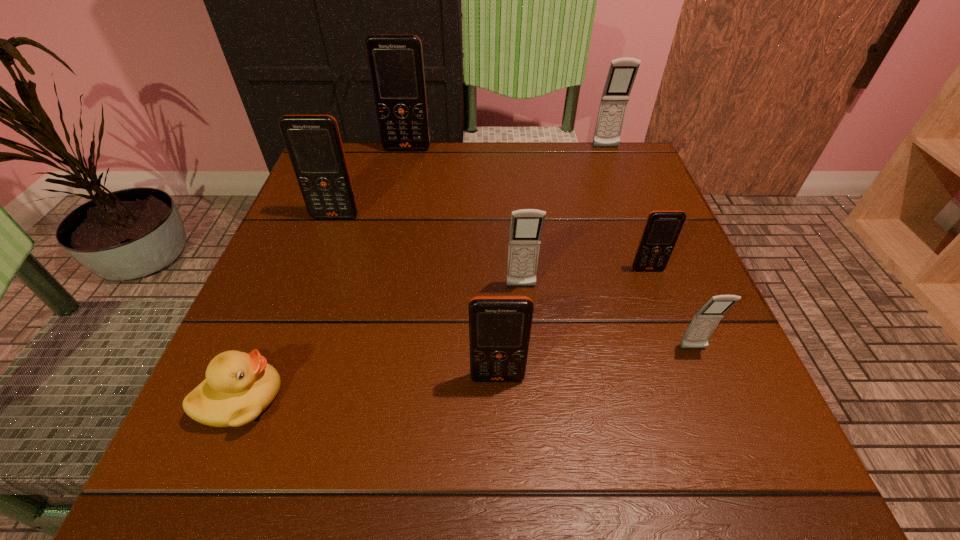
Select which gray cellular telephone is the closest to the sixth farthest object. Please provide its 2D coordinates. Your answer should be formatted as a tuple, i.e. [(x, y)], where the tuple contains the x and y coordinates of a point satisfying the conditions above.

[(526, 227)]

At what (x,y) coordinates should I click in order to perform the action: click on gray cellular telephone identified as the third closest to the second biggest orange cellular telephone. Please return your answer as a coordinate pair (x, y). This screenshot has width=960, height=540. Looking at the image, I should click on (703, 324).

Locate an element on the screen. The width and height of the screenshot is (960, 540). vacant position in the image that satisfies the following two spatial constraints: 1. on the screen of the tallest cellular telephone; 2. on the front-facing side of the duckling is located at coordinates (352, 398).